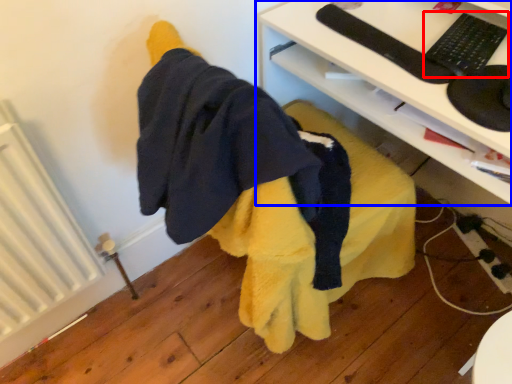
Question: Which object appears closest to the camera in this image, keyboard (highlighted by a red box) or desk (highlighted by a blue box)?

Choices:
 (A) keyboard
 (B) desk

Answer: (B)